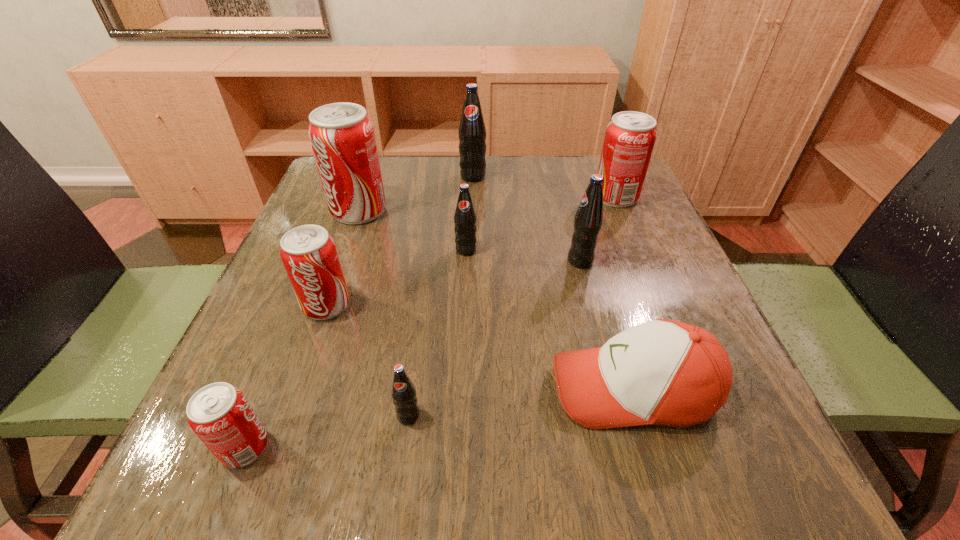
Identify the location of the biggest black pop. The image size is (960, 540). (472, 132).

Image resolution: width=960 pixels, height=540 pixels. What are the coordinates of `the farthest soda can` in the screenshot? It's located at (472, 132).

Where is `the biggest red soda can`? This screenshot has height=540, width=960. the biggest red soda can is located at coordinates (342, 137).

Identify the location of the rightmost red soda can. (630, 137).

This screenshot has width=960, height=540. I want to click on the third smallest red soda can, so click(630, 137).

You are a GUI agent. You are given a task and a screenshot of the screen. Output one action in this format:
    pyautogui.click(x=<x>, y=<y>)
    Task: Click on the third smallest black pop
    The height and width of the screenshot is (540, 960).
    Given the screenshot: What is the action you would take?
    pyautogui.click(x=588, y=220)

You are a GUI agent. You are given a task and a screenshot of the screen. Output one action in this format:
    pyautogui.click(x=<x>, y=<y>)
    Task: Click on the rightmost black pop
    This screenshot has width=960, height=540.
    Given the screenshot: What is the action you would take?
    pyautogui.click(x=588, y=220)

Where is `the third biggest black pop`? the third biggest black pop is located at coordinates (465, 219).

The image size is (960, 540). I want to click on the third nearest soda can, so [x=309, y=255].

At what (x,y) coordinates should I click in order to perform the action: click on the second smallest red soda can. Please return your answer as a coordinate pair (x, y). The width and height of the screenshot is (960, 540). Looking at the image, I should click on point(309,255).